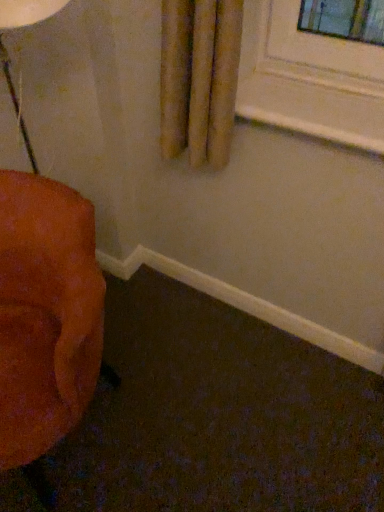
Question: Is white painted wood at upper center bigger than velvet orange chair at left?

Choices:
 (A) yes
 (B) no

Answer: (B)

Question: Could velvet orange chair at left be considered to be inside white painted wood at upper center?

Choices:
 (A) no
 (B) yes

Answer: (A)

Question: From the image's perspective, is white painted wood at upper center on top of velvet orange chair at left?

Choices:
 (A) yes
 (B) no

Answer: (A)

Question: Is white painted wood at upper center thinner than velvet orange chair at left?

Choices:
 (A) yes
 (B) no

Answer: (A)

Question: From the image's perspective, is white painted wood at upper center under velvet orange chair at left?

Choices:
 (A) no
 (B) yes

Answer: (A)

Question: Is white painted wood at upper center taller than velvet orange chair at left?

Choices:
 (A) yes
 (B) no

Answer: (B)

Question: Is velvet orange chair at left completely or partially outside of white painted wood at upper center?

Choices:
 (A) no
 (B) yes

Answer: (B)

Question: Is velvet orange chair at left not close to white painted wood at upper center?

Choices:
 (A) yes
 (B) no

Answer: (B)

Question: Is velvet orange chair at left looking in the opposite direction of white painted wood at upper center?

Choices:
 (A) no
 (B) yes

Answer: (A)

Question: Considering the relative sizes of velvet orange chair at left and white painted wood at upper center in the image provided, is velvet orange chair at left thinner than white painted wood at upper center?

Choices:
 (A) no
 (B) yes

Answer: (A)

Question: From a real-world perspective, is velvet orange chair at left over white painted wood at upper center?

Choices:
 (A) yes
 (B) no

Answer: (B)

Question: Is velvet orange chair at left taller than white painted wood at upper center?

Choices:
 (A) yes
 (B) no

Answer: (A)

Question: From the image's perspective, is white painted wood at upper center located above or below velvet orange chair at left?

Choices:
 (A) below
 (B) above

Answer: (B)